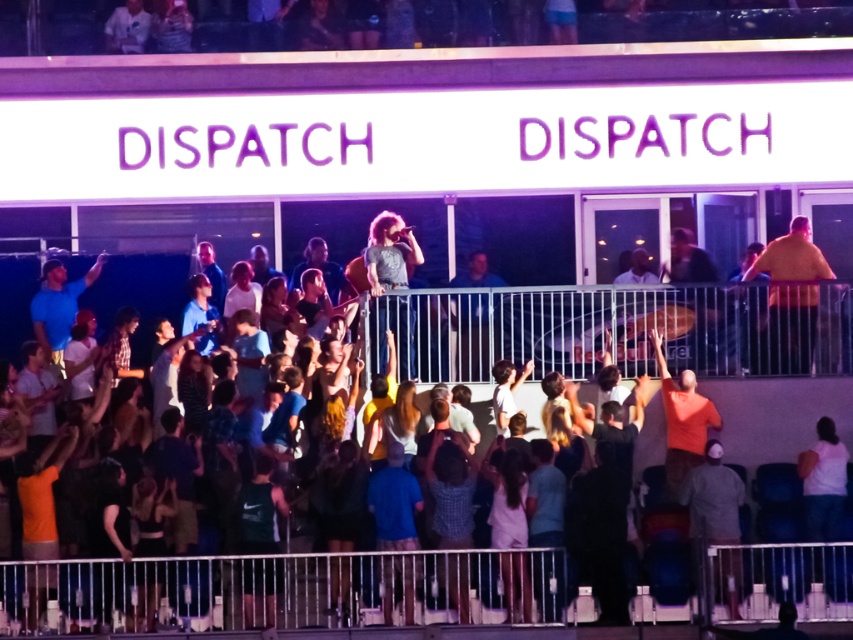
Looking at this image, you are standing at the back of the concert venue and want to take a photo of both point (824, 353) and point (810, 266) in the image. Based on their positions, which point should you focus on first to ensure both are in frame?

Point (824, 353) should be focused on first because it is closer to the camera than point (810, 266), ensuring both points remain within the frame when adjusting the camera angle.